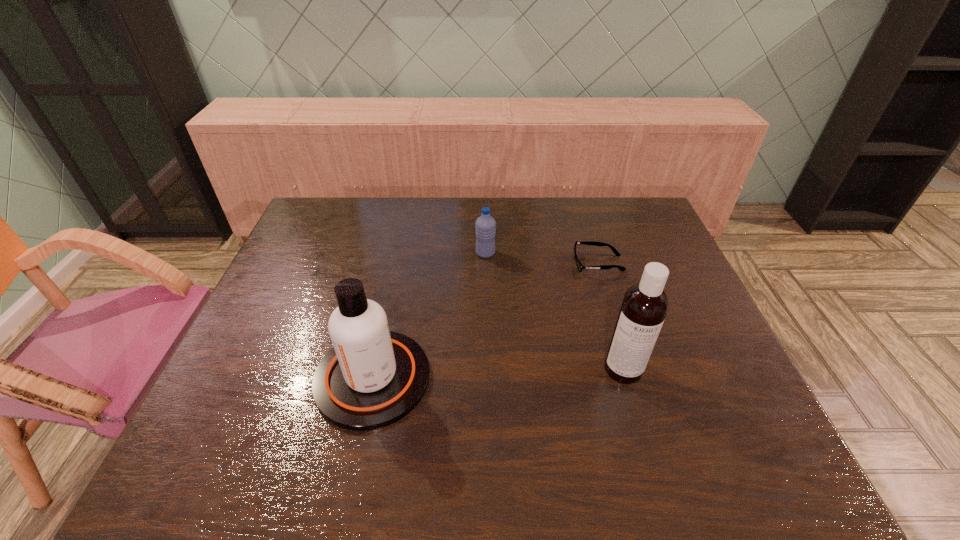
The height and width of the screenshot is (540, 960). I want to click on free location that satisfies the following two spatial constraints: 1. on the front-facing side of the shortest object; 2. on the label side of the dishwasher detergent, so click(x=631, y=369).

The height and width of the screenshot is (540, 960). I want to click on free spot that satisfies the following two spatial constraints: 1. on the front-facing side of the sunglasses; 2. on the label side of the dishwasher detergent, so click(631, 369).

Locate an element on the screen. free spot that satisfies the following two spatial constraints: 1. on the front-facing side of the sunglasses; 2. on the front side of the leftmost object is located at coordinates (634, 378).

Identify the location of free space that satisfies the following two spatial constraints: 1. on the front-facing side of the shortest object; 2. on the label side of the dishwasher detergent. The image size is (960, 540). (631, 369).